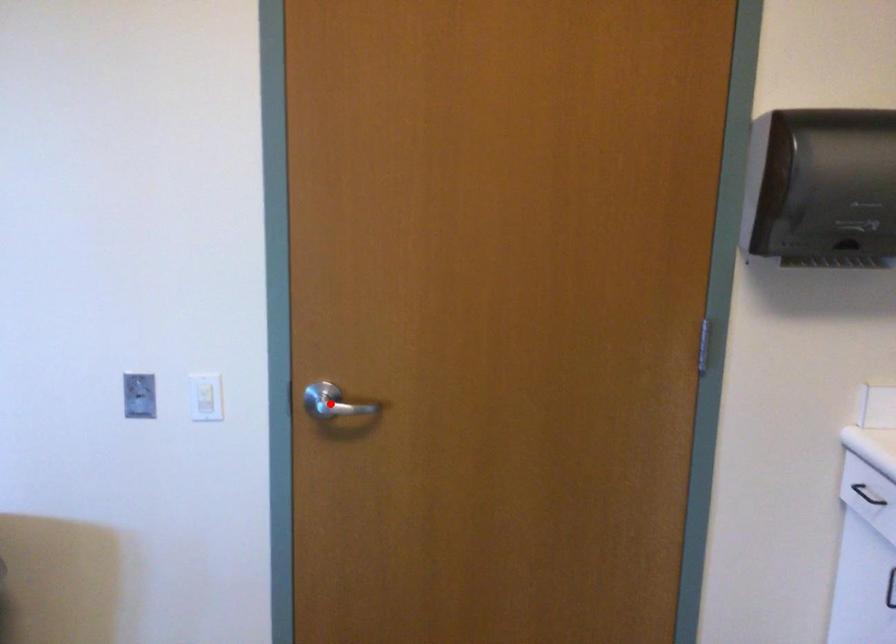
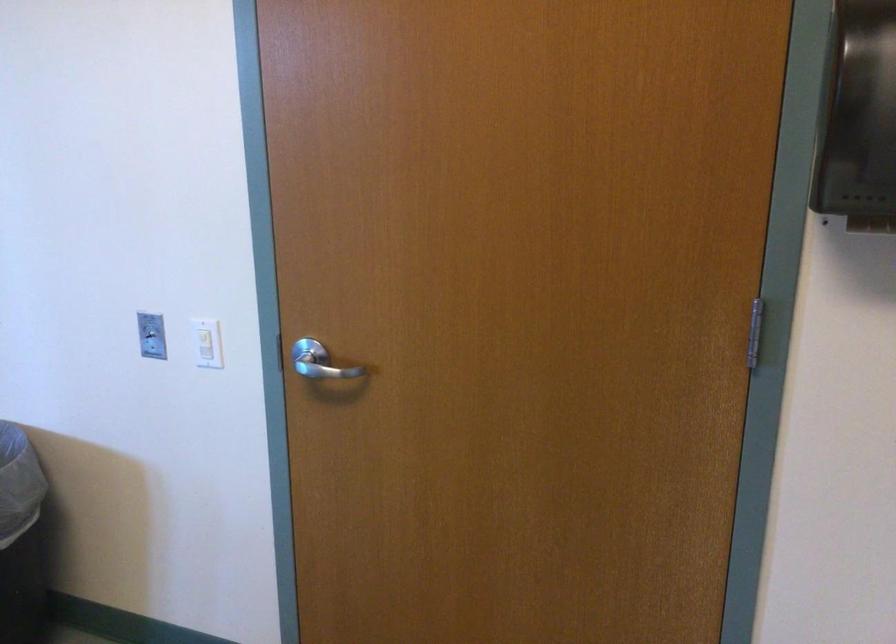
Find the pixel in the second image that matches the highlighted location in the first image.

(319, 362)